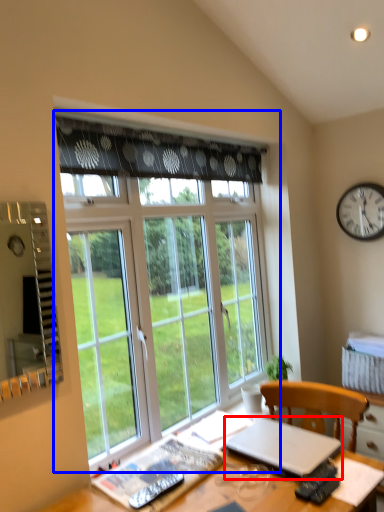
Question: Among these objects, which one is nearest to the camera, laptop (highlighted by a red box) or window (highlighted by a blue box)?

Choices:
 (A) laptop
 (B) window

Answer: (A)